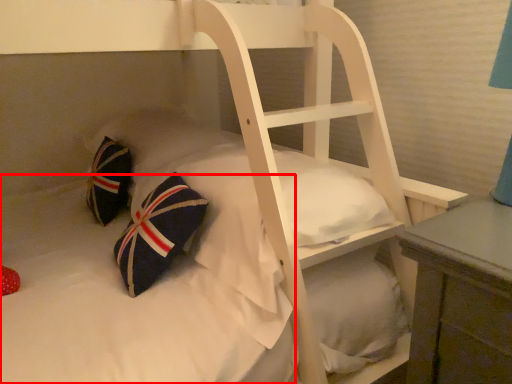
Question: From the image's perspective, where is mattress (annotated by the red box) located in relation to pillow in the image?

Choices:
 (A) below
 (B) above

Answer: (A)